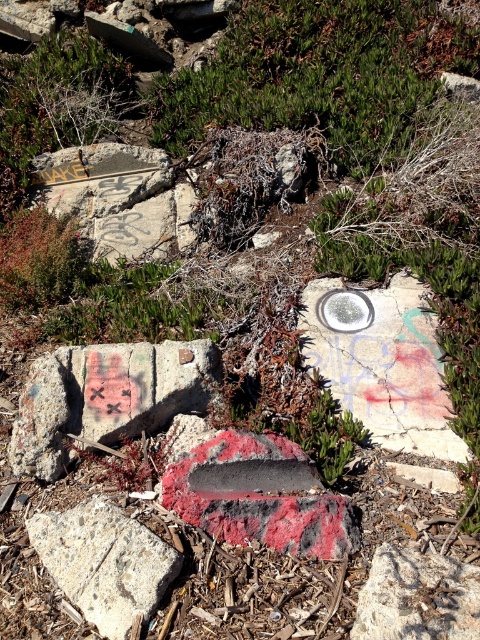
You are a photographer trying to capture both the painted concrete block at center and the speckled concrete rock at lower left in a single frame. Which object should you focus on first to ensure both are in focus?

You should focus on the painted concrete block at center first because it is closer to you than the speckled concrete rock at lower left, so focusing on the closer object will ensure the farther one is also in focus.

You are a geologist examining the speckled concrete rock at lower left and the smooth gray rock at center. Which rock is taller?

The speckled concrete rock at lower left is taller than the smooth gray rock at center.